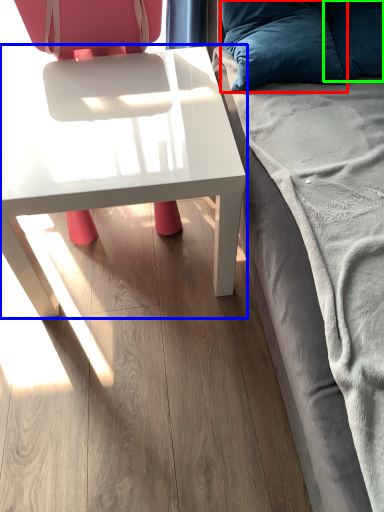
Question: Which is farther away from pillow (highlighted by a red box)? table (highlighted by a blue box) or pillow (highlighted by a green box)?

Choices:
 (A) table
 (B) pillow

Answer: (A)